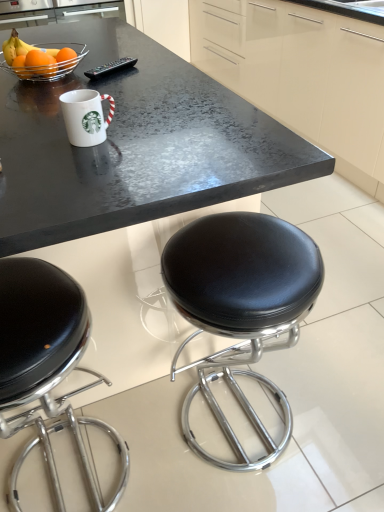
Question: Is metallic wire basket at upper left bigger or smaller than matte orange at upper left, which ranks as the 1th orange in front-to-back order?

Choices:
 (A) small
 (B) big

Answer: (B)

Question: Is metallic wire basket at upper left taller or shorter than matte orange at upper left, the second orange when ordered from back to front?

Choices:
 (A) short
 (B) tall

Answer: (A)

Question: Estimate the real-world distances between objects in this image. Which object is closer to the glossy cream cabinetry at upper center?

Choices:
 (A) black leather stool at center
 (B) metallic wire basket at upper left
 (C) white glossy mug at upper center
 (D) orangesmoothfruit at upper left, which is the first orange in back-to-front order
 (E) black leather stool at lower left

Answer: (B)

Question: Which object is the farthest from the black plastic remote control at upper center?

Choices:
 (A) matte orange at upper left, which ranks as the 1th orange in front-to-back order
 (B) white glossy mug at upper center
 (C) orangesmoothfruit at upper left, which is the first orange in back-to-front order
 (D) black leather stool at center
 (E) glossy cream cabinetry at upper center

Answer: (E)